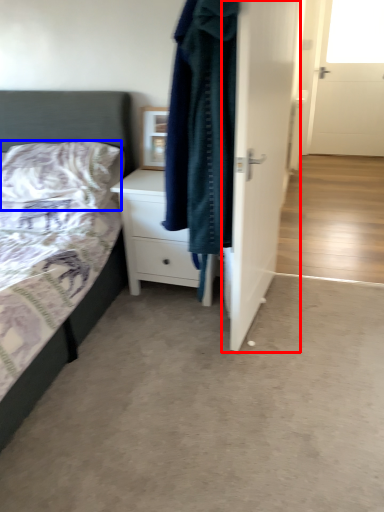
Question: Which object is further to the camera taking this photo, door (highlighted by a red box) or pillow (highlighted by a blue box)?

Choices:
 (A) door
 (B) pillow

Answer: (B)